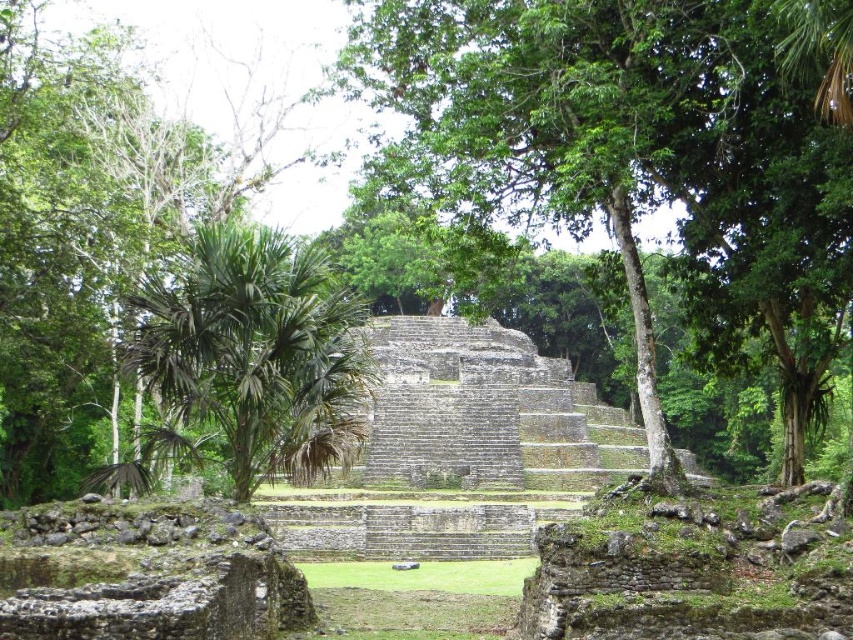
Question: In this image, where is green leafy tree at center located relative to green leafy palm tree at center?

Choices:
 (A) below
 (B) above

Answer: (B)

Question: Can you confirm if green leafy tree at center is positioned above green leafy palm tree at center?

Choices:
 (A) no
 (B) yes

Answer: (B)

Question: Which point is farther from the camera taking this photo?

Choices:
 (A) (503, 209)
 (B) (352, 337)

Answer: (B)

Question: Which point is closer to the camera taking this photo?

Choices:
 (A) (245, 422)
 (B) (653, 369)

Answer: (B)

Question: Does green leafy tree at center come behind green leafy palm tree at center?

Choices:
 (A) yes
 (B) no

Answer: (B)